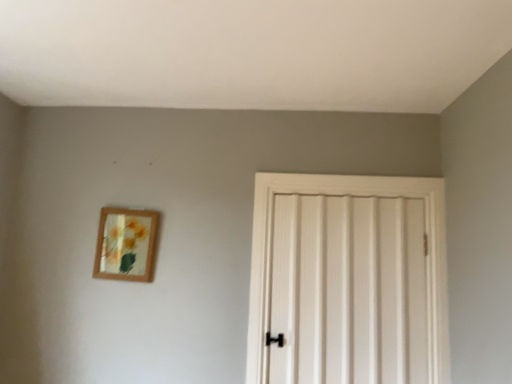
Question: Should I look upward or downward to see wooden frame at upper left?

Choices:
 (A) down
 (B) up

Answer: (A)

Question: Is the surface of wooden frame at upper left in direct contact with white wooden door at center?

Choices:
 (A) yes
 (B) no

Answer: (B)

Question: Is wooden frame at upper left to the left of white wooden door at center from the viewer's perspective?

Choices:
 (A) no
 (B) yes

Answer: (B)

Question: Does wooden frame at upper left have a larger size compared to white wooden door at center?

Choices:
 (A) no
 (B) yes

Answer: (A)

Question: From the image's perspective, is wooden frame at upper left located beneath white wooden door at center?

Choices:
 (A) no
 (B) yes

Answer: (A)

Question: Is wooden frame at upper left wider than white wooden door at center?

Choices:
 (A) no
 (B) yes

Answer: (A)

Question: From a real-world perspective, is wooden frame at upper left below white wooden door at center?

Choices:
 (A) no
 (B) yes

Answer: (A)

Question: Does white wooden door at center have a greater height compared to wooden frame at upper left?

Choices:
 (A) yes
 (B) no

Answer: (A)

Question: Is white wooden door at center positioned behind wooden frame at upper left?

Choices:
 (A) no
 (B) yes

Answer: (A)

Question: Is the position of white wooden door at center less distant than that of wooden frame at upper left?

Choices:
 (A) yes
 (B) no

Answer: (A)

Question: From the image's perspective, would you say white wooden door at center is positioned over wooden frame at upper left?

Choices:
 (A) no
 (B) yes

Answer: (A)

Question: Can you confirm if white wooden door at center is smaller than wooden frame at upper left?

Choices:
 (A) no
 (B) yes

Answer: (A)

Question: Is white wooden door at center aimed at wooden frame at upper left?

Choices:
 (A) yes
 (B) no

Answer: (B)

Question: In the image, is white wooden door at center positioned in front of or behind wooden frame at upper left?

Choices:
 (A) front
 (B) behind

Answer: (A)